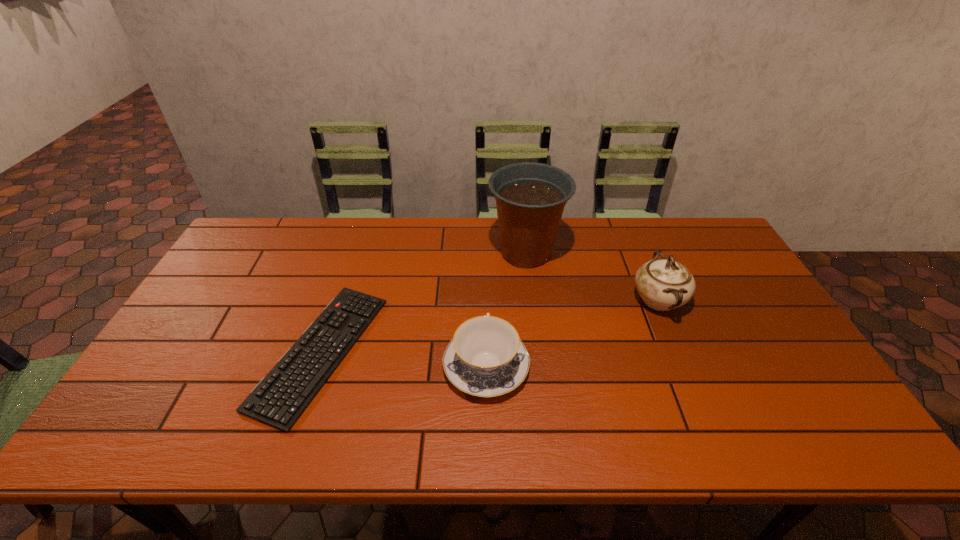
The image size is (960, 540). Identify the location of free space located with the handle on the side of the nearer chinaware. (486, 301).

The height and width of the screenshot is (540, 960). What are the coordinates of `blank space located with the handle on the side of the nearer chinaware` in the screenshot? It's located at (485, 251).

You are a GUI agent. You are given a task and a screenshot of the screen. Output one action in this format:
    pyautogui.click(x=<x>, y=<y>)
    Task: Click on the free location located 0.330m on the back of the computer keyboard
    This screenshot has width=960, height=540.
    Given the screenshot: What is the action you would take?
    tap(363, 227)

In order to click on object at the far edge in this screenshot , I will do `click(530, 197)`.

Where is `object at the near edge`? The image size is (960, 540). object at the near edge is located at coordinates (280, 398).

Where is `free region at the far edge of the desktop`? This screenshot has height=540, width=960. free region at the far edge of the desktop is located at coordinates (320, 247).

Find the location of a particular element. This screenshot has width=960, height=540. vacant area at the near edge of the desktop is located at coordinates (740, 437).

I want to click on free space at the left edge of the desktop, so (133, 407).

Where is `vacant area at the far left corner of the desktop`? vacant area at the far left corner of the desktop is located at coordinates (243, 233).

Where is `empty location between the shortest object and the tallest object`? This screenshot has width=960, height=540. empty location between the shortest object and the tallest object is located at coordinates (423, 302).